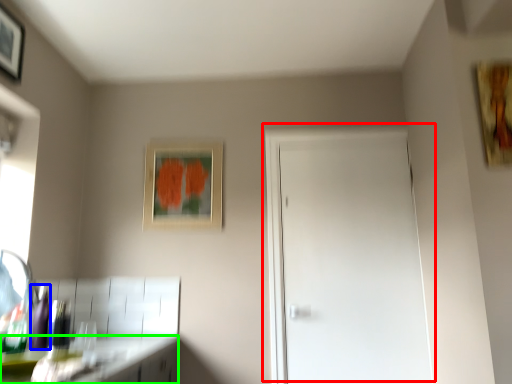
Question: Which object is the farthest from door (highlighted by a red box)? Choose among these: bottle (highlighted by a blue box) or counter top (highlighted by a green box).

Choices:
 (A) bottle
 (B) counter top

Answer: (A)